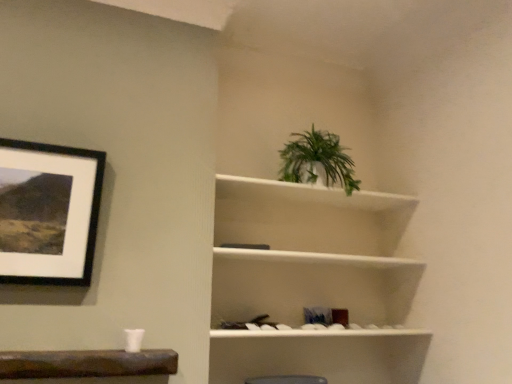
Question: From the image's perspective, is black matte picture frame at upper left on top of white matte shelf at upper right?

Choices:
 (A) yes
 (B) no

Answer: (A)

Question: Is black matte picture frame at upper left to the left of white matte shelf at upper right from the viewer's perspective?

Choices:
 (A) yes
 (B) no

Answer: (A)

Question: Is black matte picture frame at upper left in contact with white matte shelf at upper right?

Choices:
 (A) no
 (B) yes

Answer: (A)

Question: Is black matte picture frame at upper left outside white matte shelf at upper right?

Choices:
 (A) no
 (B) yes

Answer: (B)

Question: Considering the relative sizes of black matte picture frame at upper left and white matte shelf at upper right in the image provided, is black matte picture frame at upper left bigger than white matte shelf at upper right?

Choices:
 (A) no
 (B) yes

Answer: (A)

Question: From their relative heights in the image, would you say black matte picture frame at upper left is taller or shorter than white matte shelf at upper right?

Choices:
 (A) tall
 (B) short

Answer: (B)

Question: Considering the positions of black matte picture frame at upper left and white matte shelf at upper right in the image, is black matte picture frame at upper left wider or thinner than white matte shelf at upper right?

Choices:
 (A) wide
 (B) thin

Answer: (B)

Question: Do you think black matte picture frame at upper left is within white matte shelf at upper right, or outside of it?

Choices:
 (A) outside
 (B) inside

Answer: (A)

Question: From a real-world perspective, is black matte picture frame at upper left above or below white matte shelf at upper right?

Choices:
 (A) above
 (B) below

Answer: (A)

Question: Is point (347, 183) closer or farther from the camera than point (367, 208)?

Choices:
 (A) farther
 (B) closer

Answer: (B)

Question: Considering the positions of green leafy plant at upper center and white matte shelf at upper right in the image, is green leafy plant at upper center taller or shorter than white matte shelf at upper right?

Choices:
 (A) short
 (B) tall

Answer: (A)

Question: Considering the positions of green leafy plant at upper center and white matte shelf at upper right in the image, is green leafy plant at upper center bigger or smaller than white matte shelf at upper right?

Choices:
 (A) small
 (B) big

Answer: (A)

Question: Which is correct: green leafy plant at upper center is inside white matte shelf at upper right, or outside of it?

Choices:
 (A) inside
 (B) outside

Answer: (B)

Question: From the image's perspective, is white matte shelf at upper right positioned above or below black matte picture frame at upper left?

Choices:
 (A) below
 (B) above

Answer: (A)

Question: Considering the positions of white matte shelf at upper right and black matte picture frame at upper left in the image, is white matte shelf at upper right wider or thinner than black matte picture frame at upper left?

Choices:
 (A) thin
 (B) wide

Answer: (B)